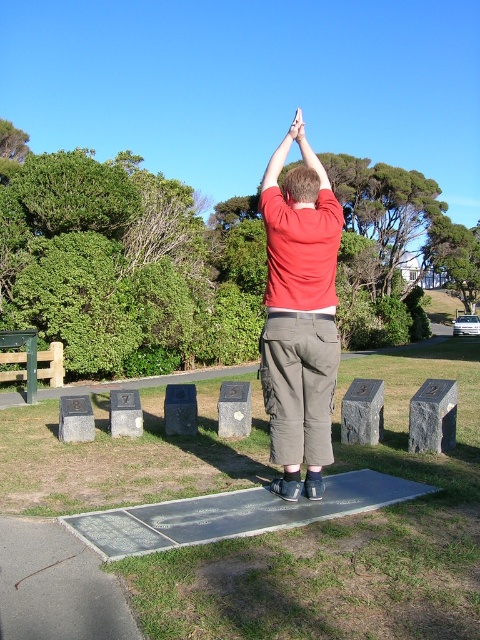
Does point (294, 360) lie in front of point (314, 196)?

Yes, it is in front of point (314, 196).

Does matte red shirt at center have a greater height compared to brown hair at upper center?

Yes, matte red shirt at center is taller than brown hair at upper center.

Between point (265, 369) and point (308, 182), which one is positioned in front?

Point (308, 182) is in front.

In order to click on matte red shirt at center in this screenshot , I will do (300, 314).